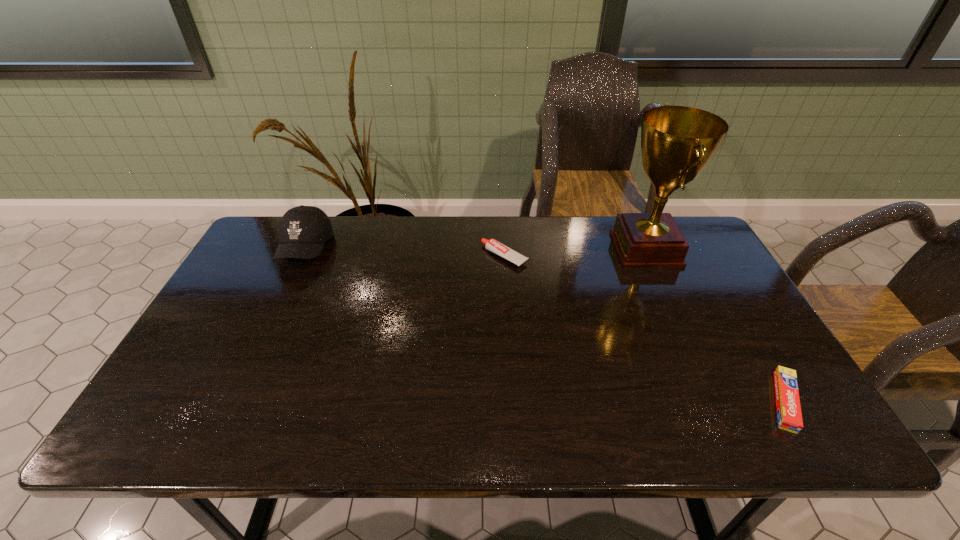
At what (x,y) coordinates should I click in order to perform the action: click on the tallest object. Please return your answer as a coordinate pair (x, y). Looking at the image, I should click on (677, 142).

Identify the location of the third object from left to right. Image resolution: width=960 pixels, height=540 pixels. (677, 142).

You are a GUI agent. You are given a task and a screenshot of the screen. Output one action in this format:
    pyautogui.click(x=<x>, y=<y>)
    Task: Click on the leftmost object
    This screenshot has height=540, width=960.
    Given the screenshot: What is the action you would take?
    pyautogui.click(x=303, y=230)

Image resolution: width=960 pixels, height=540 pixels. I want to click on the second tallest object, so click(303, 230).

You are a GUI agent. You are given a task and a screenshot of the screen. Output one action in this format:
    pyautogui.click(x=<x>, y=<y>)
    Task: Click on the taller toothpaste
    The image size is (960, 540).
    Given the screenshot: What is the action you would take?
    pyautogui.click(x=492, y=245)

Find the location of `the second object from left to right`. the second object from left to right is located at coordinates (x=492, y=245).

This screenshot has height=540, width=960. Identify the location of the shorter toothpaste. (789, 415).

Identify the location of the nearer toothpaste. The height and width of the screenshot is (540, 960). (789, 415).

This screenshot has width=960, height=540. Identify the location of free region located 0.350m on the plaque of the tallest object. (502, 249).

Identify the location of blank area located on the plaque of the tallest object. The image size is (960, 540). (588, 249).